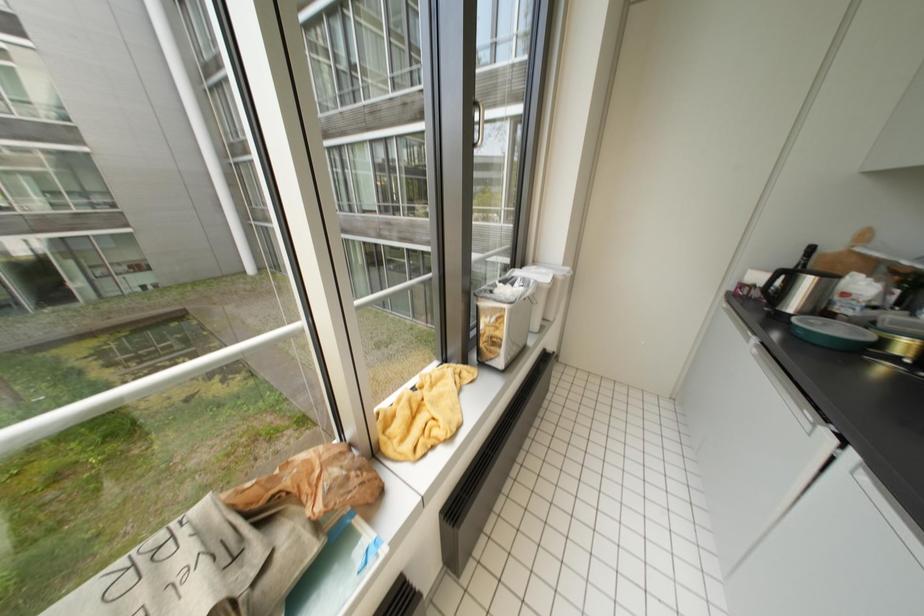
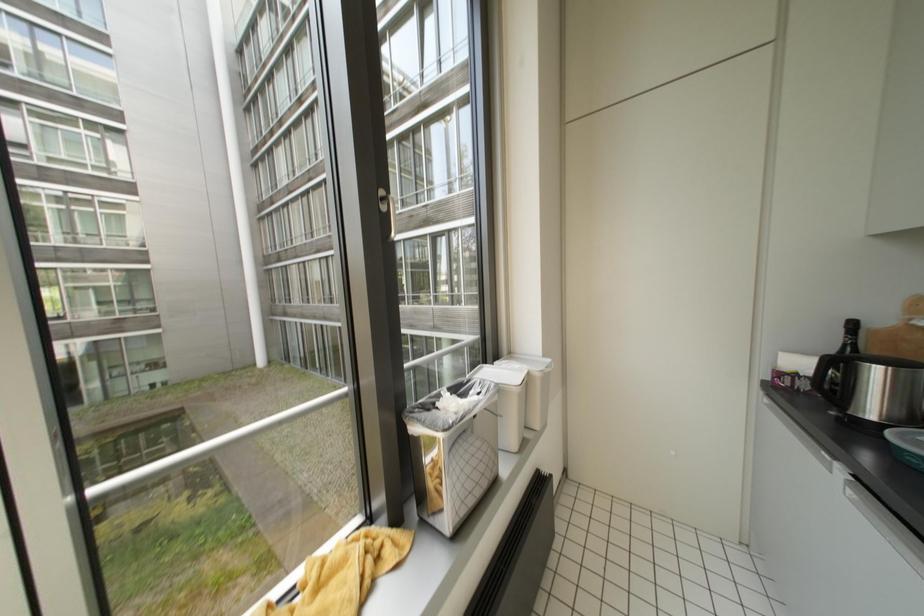
Question: The images are taken continuously from a first-person perspective. In which direction is your viewpoint rotating?

Choices:
 (A) Left
 (B) Right
 (C) Up
 (D) Down

Answer: (C)